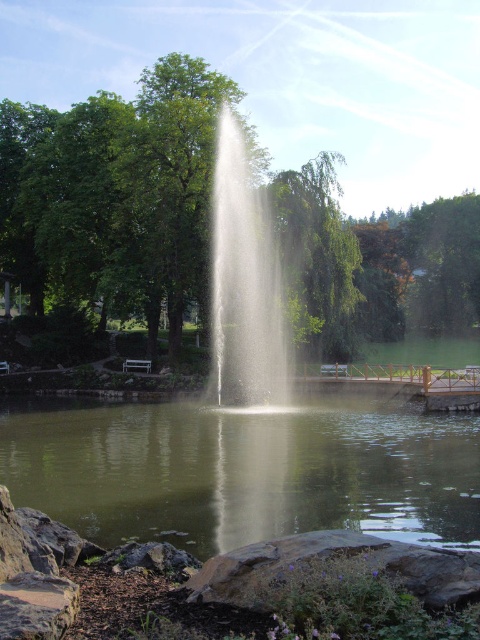
Is white misty fountain at center behind wooden bench at center?

No, white misty fountain at center is in front of wooden bench at center.

Between white misty fountain at center and wooden bench at center, which one has more height?

white misty fountain at center is taller.

This screenshot has width=480, height=640. Find the location of `white misty fountain at center`. white misty fountain at center is located at coordinates (243, 282).

Locate an element on the screen. The height and width of the screenshot is (640, 480). white misty fountain at center is located at coordinates (243, 282).

Is clear water at center smaller than white misty fountain at center?

Yes.

Is clear water at center above white misty fountain at center?

No, clear water at center is not above white misty fountain at center.

From the picture: Who is more forward, (336, 401) or (217, 310)?

Point (336, 401) is in front.

The width and height of the screenshot is (480, 640). What are the coordinates of `clear water at center` in the screenshot? It's located at (244, 470).

Between clear water at center and wooden bench at center, which one appears on the right side from the viewer's perspective?

clear water at center

Does clear water at center have a lesser width compared to wooden bench at center?

Incorrect, clear water at center's width is not less than wooden bench at center's.

Measure the distance between clear water at center and camera.

27.18 feet

You are a GUI agent. You are given a task and a screenshot of the screen. Output one action in this format:
    pyautogui.click(x=<x>, y=<y>)
    Task: Click on the clear water at center
    The width and height of the screenshot is (480, 640).
    Given the screenshot: What is the action you would take?
    pyautogui.click(x=244, y=470)